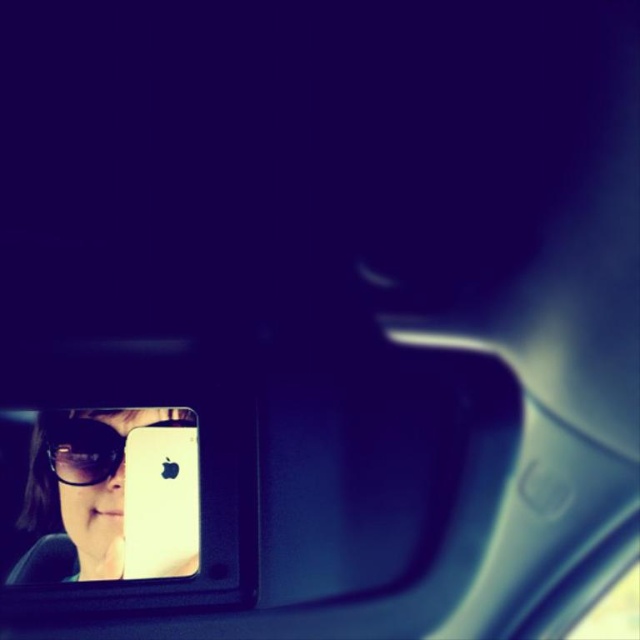
Question: Can you confirm if white matte smartphone at center is wider than matte black goggles at lower left?

Choices:
 (A) no
 (B) yes

Answer: (A)

Question: Is matte black sunglasses at lower left to the right of matte black goggles at lower left from the viewer's perspective?

Choices:
 (A) no
 (B) yes

Answer: (A)

Question: Considering the real-world distances, which object is farthest from the matte black goggles at lower left?

Choices:
 (A) white matte smartphone at center
 (B) matte black sunglasses at lower left

Answer: (A)

Question: Which point is closer to the camera?

Choices:
 (A) (125, 568)
 (B) (97, 448)

Answer: (A)

Question: Based on their relative distances, which object is nearer to the matte black goggles at lower left?

Choices:
 (A) matte black sunglasses at lower left
 (B) white matte smartphone at center

Answer: (A)

Question: Can you confirm if white matte smartphone at center is positioned below matte black goggles at lower left?

Choices:
 (A) no
 (B) yes

Answer: (B)